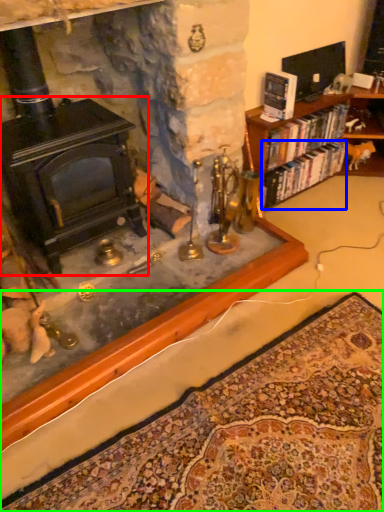
Question: Considering the real-world distances, which object is closest to fireplace (highlighted by a red box)? book (highlighted by a blue box) or mat (highlighted by a green box).

Choices:
 (A) book
 (B) mat

Answer: (B)